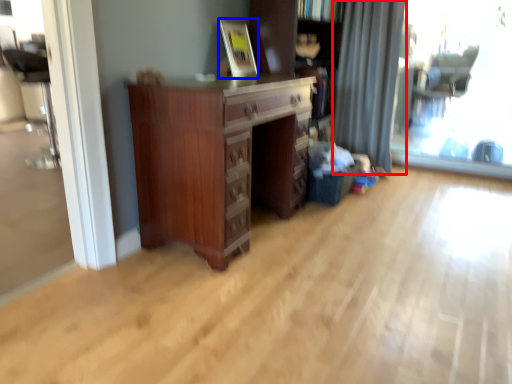
Question: Which point is closer to the camera, curtain (highlighted by a red box) or picture frame (highlighted by a blue box)?

Choices:
 (A) curtain
 (B) picture frame

Answer: (B)